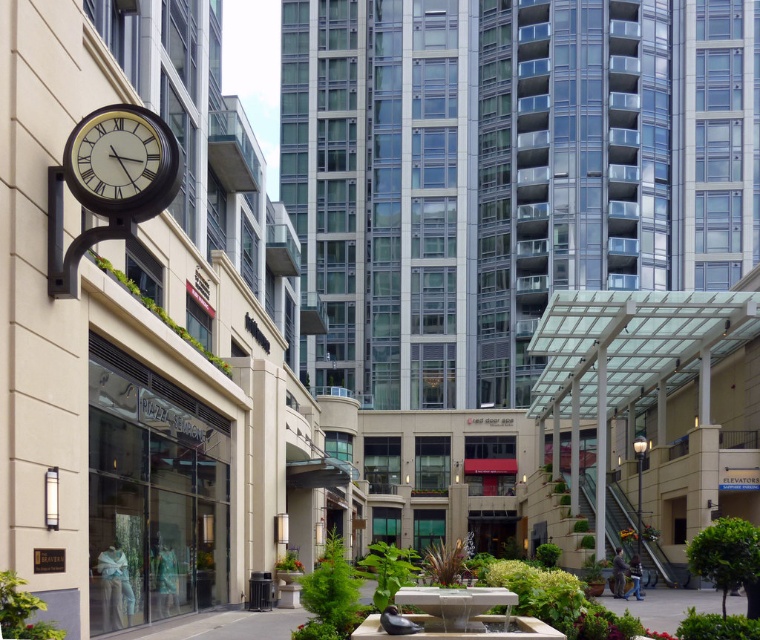
You are a visitor in this urban area and need to know which object is taller between the matte white clock at upper left and the white stone fountain at center. Can you tell me?

The matte white clock at upper left is taller than the white stone fountain at center according to the description.

You are a city planner assessing the layout of this urban area. You need to determine if the matte white clock at upper left can be moved to the plaza area without obstructing the white stone fountain at center. Based on their sizes, is this feasible?

The matte white clock at upper left has a lesser width compared to the white stone fountain at center, so moving it to the plaza area should be feasible without obstructing the fountain.

You are standing in the commercial district and want to reach a specific point marked at coordinates point (163, 179). If your current position is 10 meters away from this point, how much further do you need to walk to reach it?

The distance of point (163, 179) from viewer is 13.31 meters. Since you are currently 10 meters away, you need to walk an additional 3.31 meters to reach the point.